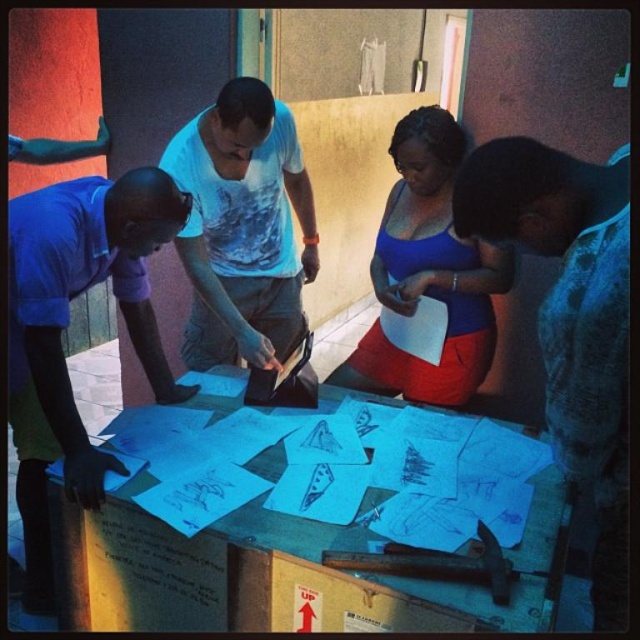
Question: Can you confirm if purple matte shirt at left is positioned to the right of white paper at center?

Choices:
 (A) no
 (B) yes

Answer: (B)

Question: In this image, where is purple matte shirt at left located relative to blue fabric top at center?

Choices:
 (A) left
 (B) right

Answer: (A)

Question: Which object is the closest to the matte blue shirt at lower right?

Choices:
 (A) white paper at center
 (B) purple matte shirt at left
 (C) blue fabric top at center
 (D) white printed t-shirt at center

Answer: (C)

Question: Which of the following is the closest to the observer?

Choices:
 (A) purple matte shirt at left
 (B) white paper at center

Answer: (A)

Question: Which object is closer to the camera taking this photo?

Choices:
 (A) white printed t-shirt at center
 (B) white paper at center
 (C) blue fabric top at center

Answer: (C)

Question: Can you confirm if purple matte shirt at left is thinner than white printed t-shirt at center?

Choices:
 (A) no
 (B) yes

Answer: (A)